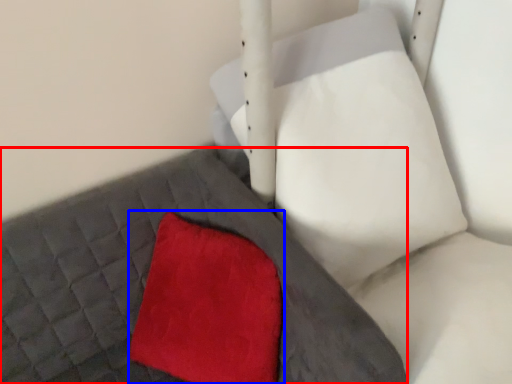
Question: Which object appears farthest to the camera in this image, bed frame (highlighted by a red box) or throw pillow (highlighted by a blue box)?

Choices:
 (A) bed frame
 (B) throw pillow

Answer: (B)